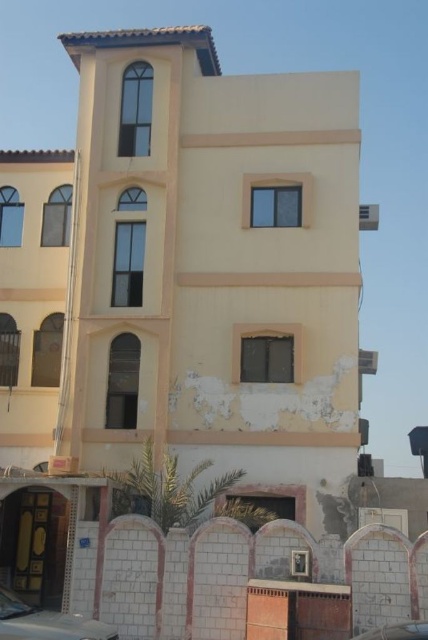
Consider the image. Is the position of metallic silver car at lower left more distant than that of metallic silver car at lower center?

Yes, it is behind metallic silver car at lower center.

Which of these two, metallic silver car at lower left or metallic silver car at lower center, stands taller?

metallic silver car at lower center

Locate an element on the screen. The height and width of the screenshot is (640, 428). metallic silver car at lower left is located at coordinates (45, 621).